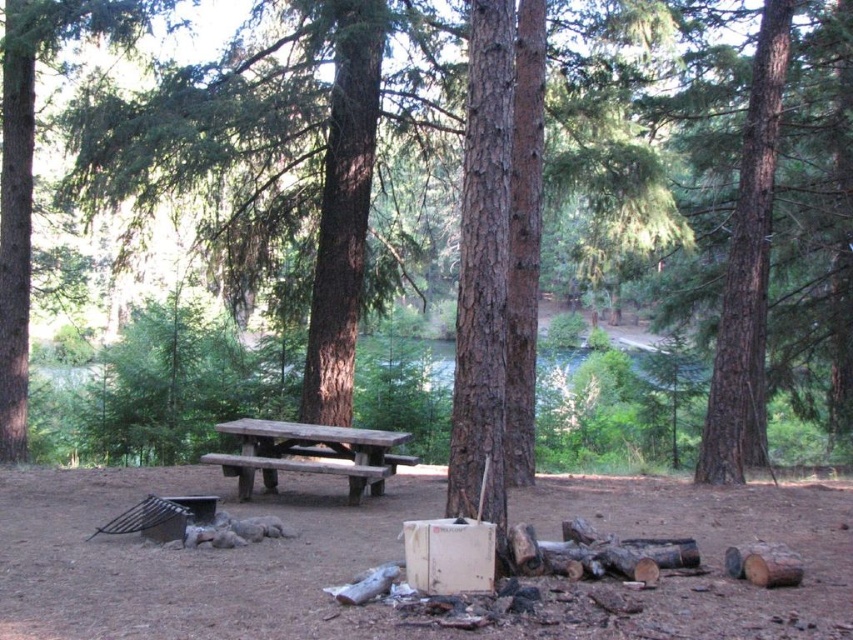
Does green rough bark tree at left appear under wooden picnic table at center?

No.

Can you confirm if green rough bark tree at left is positioned to the left of wooden picnic table at center?

Correct, you'll find green rough bark tree at left to the left of wooden picnic table at center.

Where is `green rough bark tree at left`? The image size is (853, 640). green rough bark tree at left is located at coordinates (32, 168).